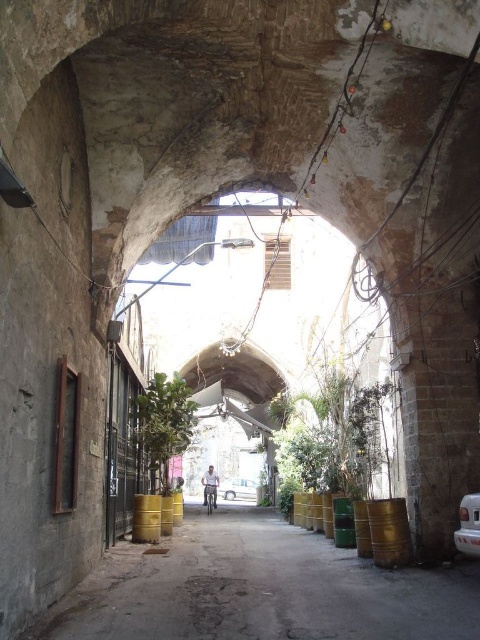
You are driving a delivery van and need to park in the narrow alleyway shown. You see the white matte van at center and the metallic silver car at center. Which vehicle should you avoid parking behind to ensure you have enough space to maneuver out later?

You should avoid parking behind the metallic silver car at center because the white matte van at center is closer to the viewer, meaning the metallic silver car is further back. Parking behind it may leave less room for maneuvering out.

You are a delivery driver trying to park your vehicle in the narrow alleyway. You have a white matte van at center and a metallic silver car at center. Which vehicle should you choose to ensure it fits in the narrow space?

The white matte van at center is smaller than the metallic silver car at center, so you should choose the white matte van at center to ensure it fits in the narrow space.

You are a delivery person trying to navigate through the narrow alleyway. You see a gold metallic barrel at center and a metallic silver car at center. Which object is closer to the ground?

The gold metallic barrel at center is shorter than the metallic silver car at center, so the gold metallic barrel at center is closer to the ground.